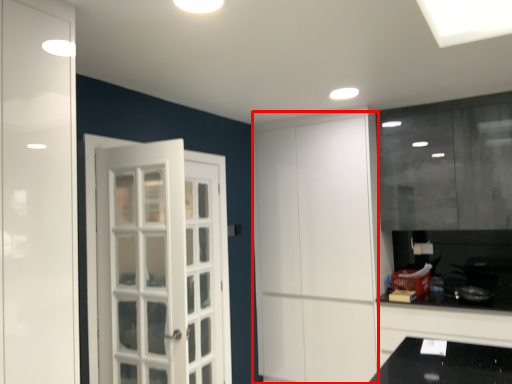
Question: From the image's perspective, where is door (annotated by the red box) located relative to cabinetry?

Choices:
 (A) above
 (B) below

Answer: (A)